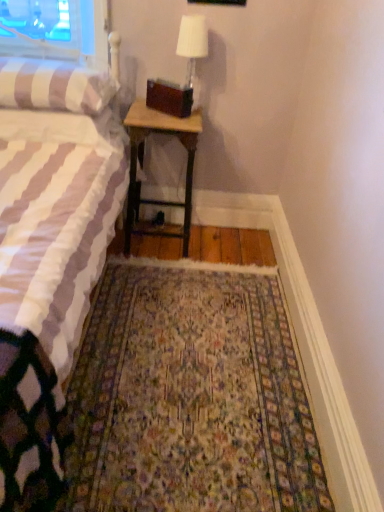
Question: Is white striped fabric bed at left bigger than floral carpet at center?

Choices:
 (A) no
 (B) yes

Answer: (B)

Question: From a real-world perspective, is white striped fabric bed at left physically above floral carpet at center?

Choices:
 (A) no
 (B) yes

Answer: (B)

Question: From the image's perspective, is white striped fabric bed at left below floral carpet at center?

Choices:
 (A) yes
 (B) no

Answer: (B)

Question: Is white striped fabric bed at left facing towards floral carpet at center?

Choices:
 (A) yes
 (B) no

Answer: (B)

Question: Considering the relative positions of white striped fabric bed at left and floral carpet at center in the image provided, is white striped fabric bed at left to the left of floral carpet at center from the viewer's perspective?

Choices:
 (A) yes
 (B) no

Answer: (A)

Question: Does white striped fabric bed at left come in front of floral carpet at center?

Choices:
 (A) no
 (B) yes

Answer: (B)

Question: Does floral carpet at center touch white striped fabric bed at left?

Choices:
 (A) yes
 (B) no

Answer: (B)

Question: From a real-world perspective, is floral carpet at center physically above white striped fabric bed at left?

Choices:
 (A) yes
 (B) no

Answer: (B)

Question: Is white striped fabric bed at left completely or partially inside floral carpet at center?

Choices:
 (A) yes
 (B) no

Answer: (B)

Question: Does floral carpet at center have a larger size compared to white striped fabric bed at left?

Choices:
 (A) yes
 (B) no

Answer: (B)

Question: Can you confirm if floral carpet at center is taller than white striped fabric bed at left?

Choices:
 (A) yes
 (B) no

Answer: (B)

Question: Is floral carpet at center behind white striped fabric bed at left?

Choices:
 (A) no
 (B) yes

Answer: (B)

Question: From a real-world perspective, is white striped fabric bed at left below wooden nightstand at center?

Choices:
 (A) yes
 (B) no

Answer: (B)